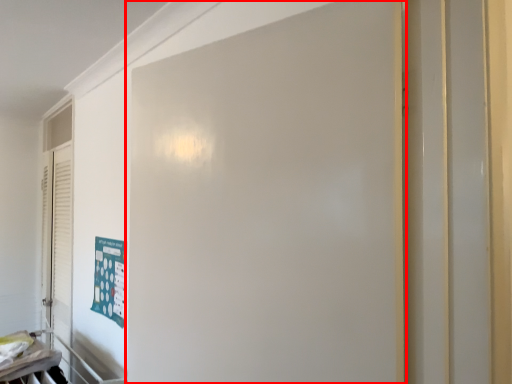
Question: From the image's perspective, where is door (annotated by the red box) located in relation to poster in the image?

Choices:
 (A) below
 (B) above

Answer: (B)